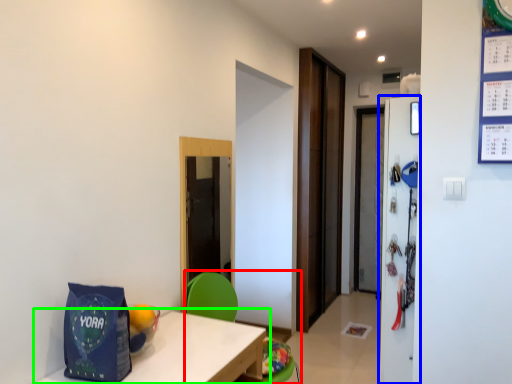
Question: Based on their relative distances, which object is farther from armchair (highlighted by a red box)? Choose from refrigerator (highlighted by a blue box) and table (highlighted by a green box).

Choices:
 (A) refrigerator
 (B) table

Answer: (A)